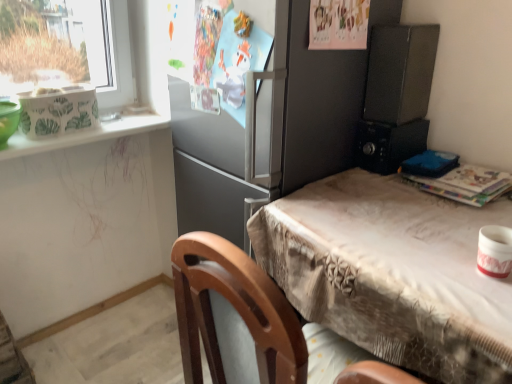
Locate an element on the screen. The height and width of the screenshot is (384, 512). free location above black plastic microwave at right, which is the second appliance in top-to-bottom order (from a real-world perspective) is located at coordinates (x=395, y=122).